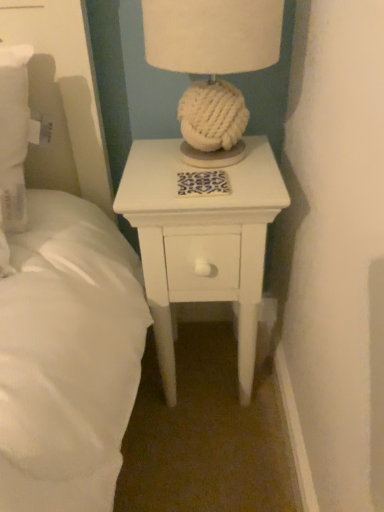
Question: Would you say white painted wood nightstand at center is to the left or to the right of white knitted ball at center in the picture?

Choices:
 (A) right
 (B) left

Answer: (B)

Question: From a real-world perspective, relative to white knitted ball at center, is white painted wood nightstand at center vertically above or below?

Choices:
 (A) above
 (B) below

Answer: (B)

Question: In terms of height, does white painted wood nightstand at center look taller or shorter compared to white knitted ball at center?

Choices:
 (A) short
 (B) tall

Answer: (B)

Question: Would you say white knitted ball at center is to the left or to the right of white painted wood nightstand at center in the picture?

Choices:
 (A) left
 (B) right

Answer: (B)

Question: From the image's perspective, relative to white painted wood nightstand at center, is white knitted ball at center above or below?

Choices:
 (A) above
 (B) below

Answer: (A)

Question: Is white knitted ball at center bigger or smaller than white painted wood nightstand at center?

Choices:
 (A) big
 (B) small

Answer: (B)

Question: Considering the positions of white knitted ball at center and white painted wood nightstand at center in the image, is white knitted ball at center taller or shorter than white painted wood nightstand at center?

Choices:
 (A) tall
 (B) short

Answer: (B)